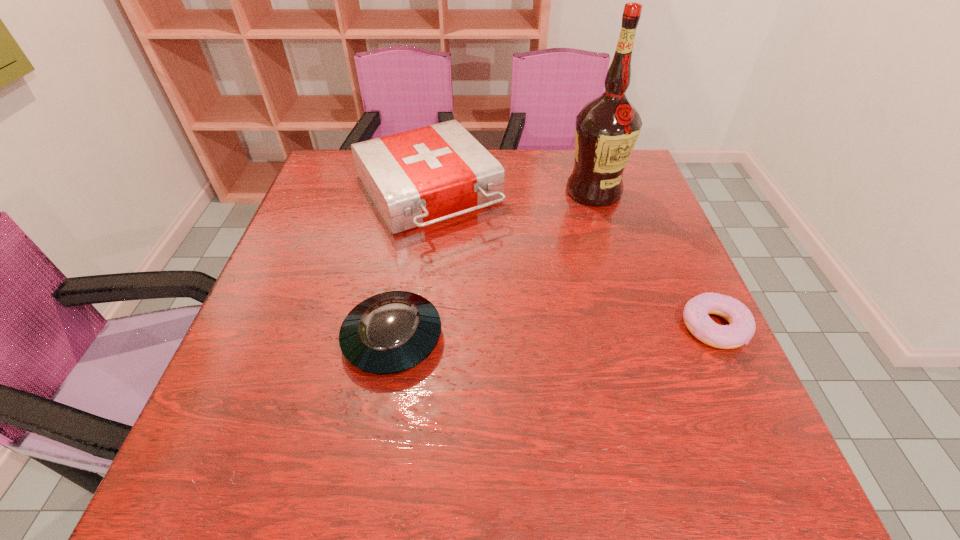
The height and width of the screenshot is (540, 960). I want to click on the second shortest object, so click(388, 333).

At what (x,y) coordinates should I click in order to perform the action: click on doughnut. Please return your answer as a coordinate pair (x, y). This screenshot has width=960, height=540. Looking at the image, I should click on (741, 328).

At what (x,y) coordinates should I click in order to perform the action: click on the rightmost object. Please return your answer as a coordinate pair (x, y). The height and width of the screenshot is (540, 960). Looking at the image, I should click on (741, 328).

This screenshot has width=960, height=540. What are the coordinates of `alcohol` in the screenshot? It's located at (606, 130).

This screenshot has width=960, height=540. Find the location of `the tallest object`. the tallest object is located at coordinates (606, 130).

You are a GUI agent. You are given a task and a screenshot of the screen. Output one action in this format:
    pyautogui.click(x=<x>, y=<y>)
    Task: Click on the first-aid kit
    
    Given the screenshot: What is the action you would take?
    pyautogui.click(x=416, y=178)

Locate an element on the screen. The width and height of the screenshot is (960, 540). free spot located on the back of the third tallest object is located at coordinates (405, 264).

Find the location of `free space located 0.110m on the back of the shortest object`. free space located 0.110m on the back of the shortest object is located at coordinates (686, 267).

Find the location of a particular element. This screenshot has height=540, width=960. free spot located 0.350m on the label of the tallest object is located at coordinates (580, 307).

Find the location of a particular element. vacant space located on the label of the tallest object is located at coordinates (588, 238).